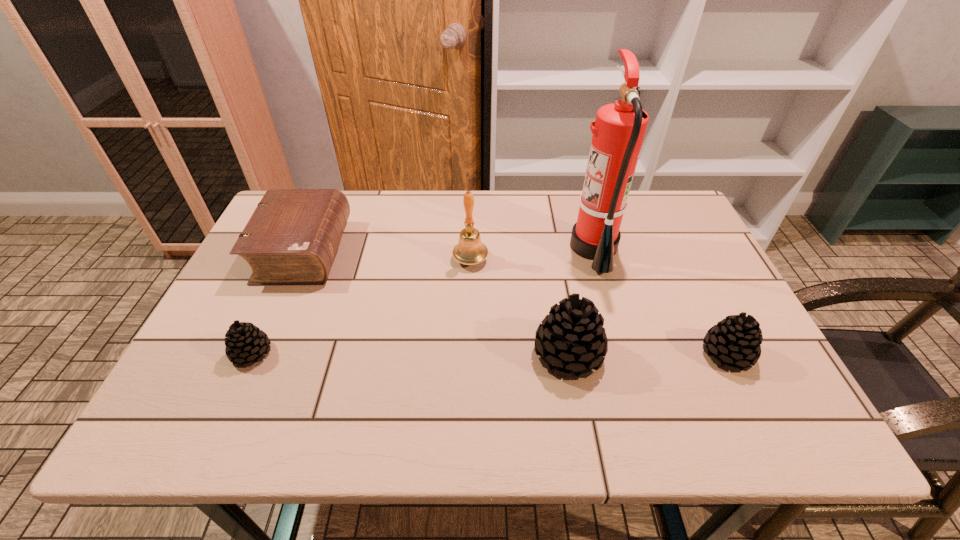
To achieve uniform spacing by inserting another pinecone among them, please point to a free space for this new pinecone. Please provide its 2D coordinates. Your answer should be formatted as a tuple, i.e. [(x, y)], where the tuple contains the x and y coordinates of a point satisfying the conditions above.

[(410, 353)]